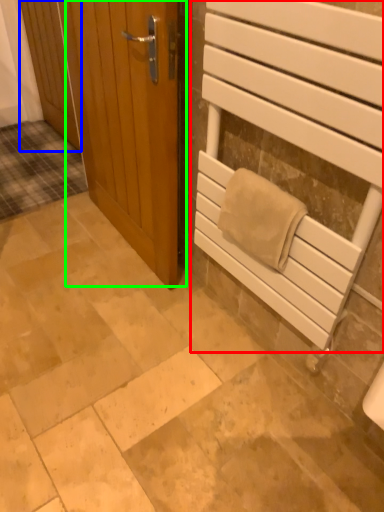
Question: Considering the real-world distances, which object is farthest from elevator (highlighted by a red box)? door (highlighted by a blue box) or door (highlighted by a green box)?

Choices:
 (A) door
 (B) door

Answer: (A)